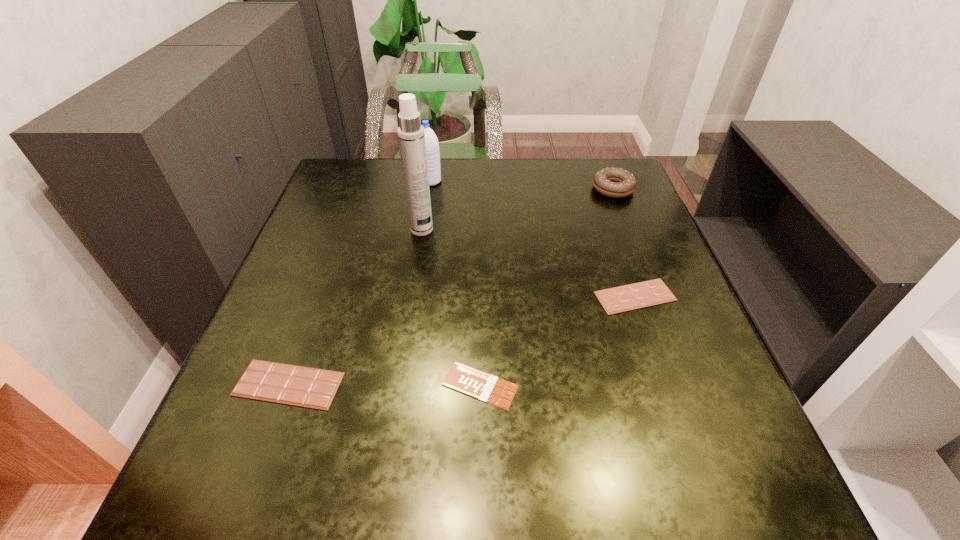
At what (x,y) coordinates should I click in order to perform the action: click on free point that satisfies the following two spatial constraints: 1. on the front side of the farthest chocolate bar; 2. on the left side of the water bottle. Please return your answer as a coordinate pair (x, y). The height and width of the screenshot is (540, 960). Looking at the image, I should click on (x=414, y=296).